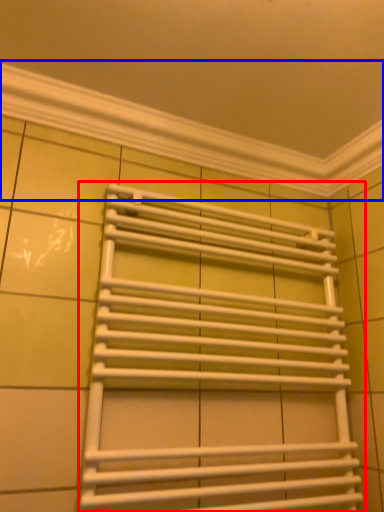
Question: Which object appears farthest to the camera in this image, towel rack (highlighted by a red box) or window frame (highlighted by a blue box)?

Choices:
 (A) towel rack
 (B) window frame

Answer: (B)